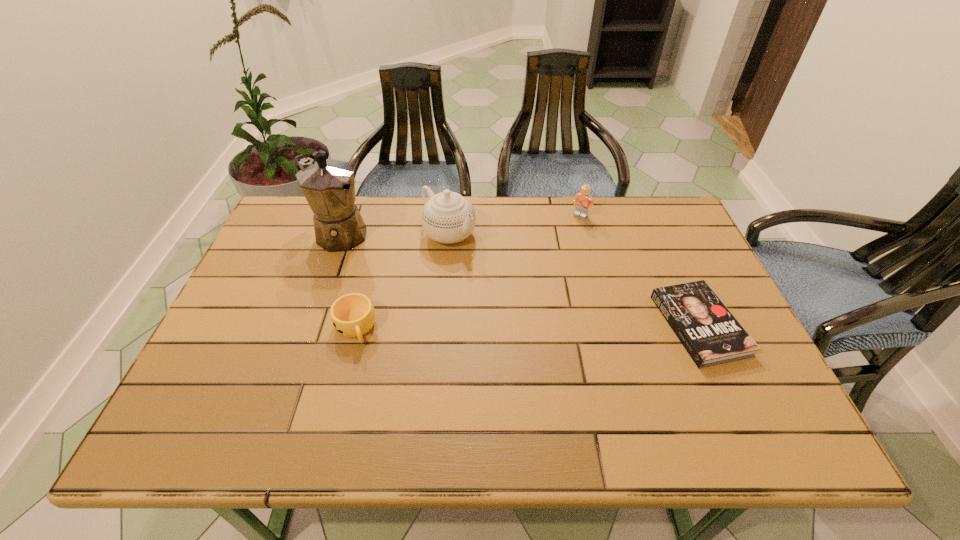
Identify the location of free space on the desktop that is between the cup and the book and is positioned on the spout of the third object from right to left. Image resolution: width=960 pixels, height=540 pixels. (579, 326).

At what (x,y) coordinates should I click in order to perform the action: click on free spot on the desktop that is between the cup and the rightmost object and is positioned on the front-facing side of the third tallest object. Please return your answer as a coordinate pair (x, y). The width and height of the screenshot is (960, 540). Looking at the image, I should click on click(481, 327).

The image size is (960, 540). Find the location of `free spot on the desktop that is between the cup and the shortest object and is positioned on the pouring side of the coffeepot`. free spot on the desktop that is between the cup and the shortest object and is positioned on the pouring side of the coffeepot is located at coordinates (477, 327).